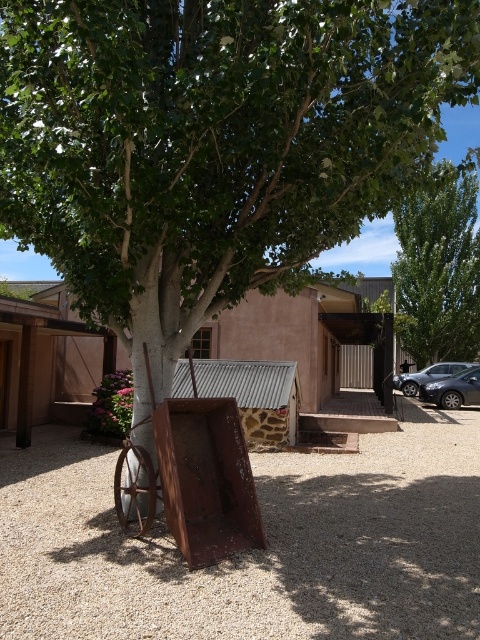
You are a delivery person needing to park your 15 feet long truck between the rustic wood cart at center and the satin black sedan at lower right. Can you fit your truck in the space between them without moving either vehicle?

The distance between the rustic wood cart at center and the satin black sedan at lower right is 37.32 feet. Since your truck is 15 feet long, there is sufficient space to park it between them without moving either vehicle.

You are planning to move the satin black sedan at lower right to a parking spot that can only accommodate vehicles smaller than the rustic wood cart at center. Based on the scene description, will the parking spot be suitable for the sedan?

The rustic wood cart at center is bigger than the satin black sedan at lower right, so the parking spot designed for vehicles smaller than the rustic wood cart at center would be suitable for the sedan since it is smaller.

You are standing at the center of the image and want to move towards the rusty metal wagon at center. Which direction should you go?

Since the rusty metal wagon at center is located at point [191,476], you should move towards the right and slightly forward to reach it.